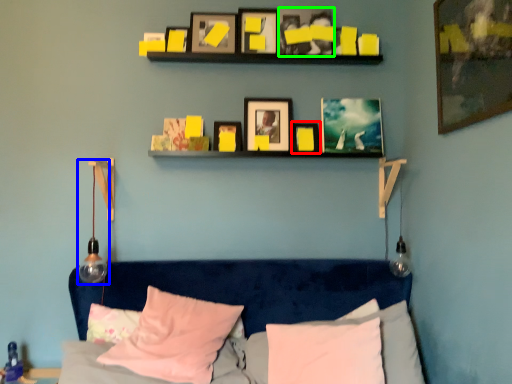
Question: Based on their relative distances, which object is nearer to picture frame (highlighted by a red box)? Choose from lamp (highlighted by a blue box) and picture frame (highlighted by a green box).

Choices:
 (A) lamp
 (B) picture frame

Answer: (B)